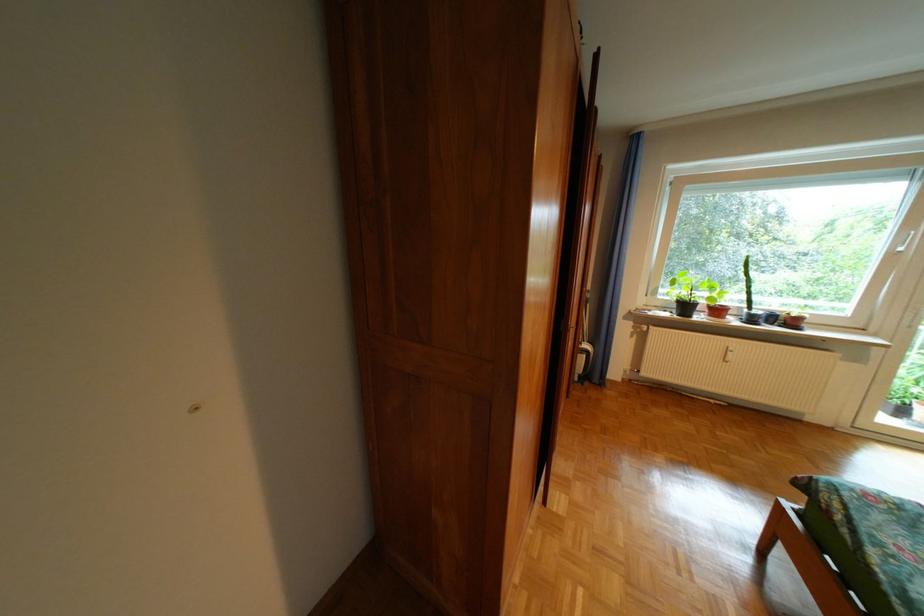
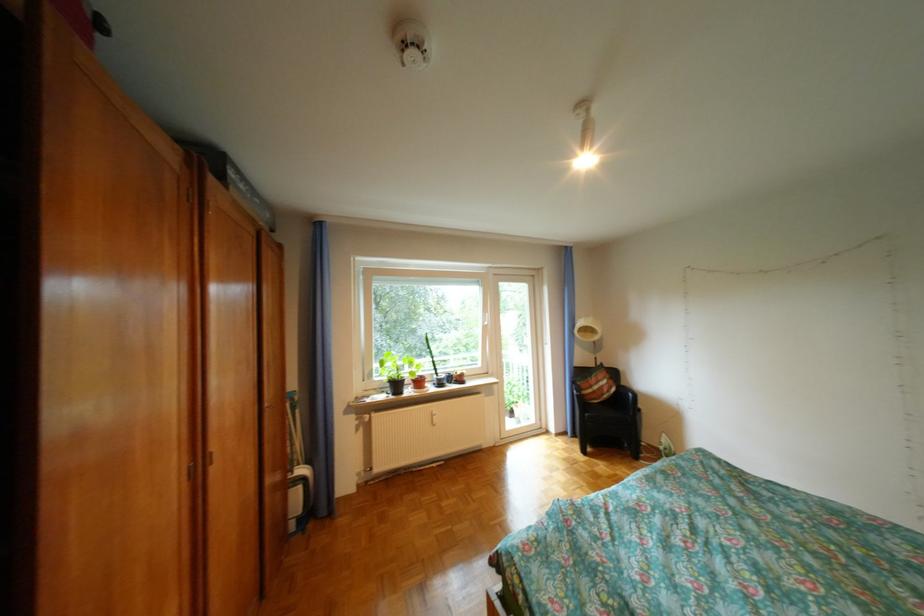
Locate, in the second image, the point that corresponds to (x=688, y=306) in the first image.

(403, 386)